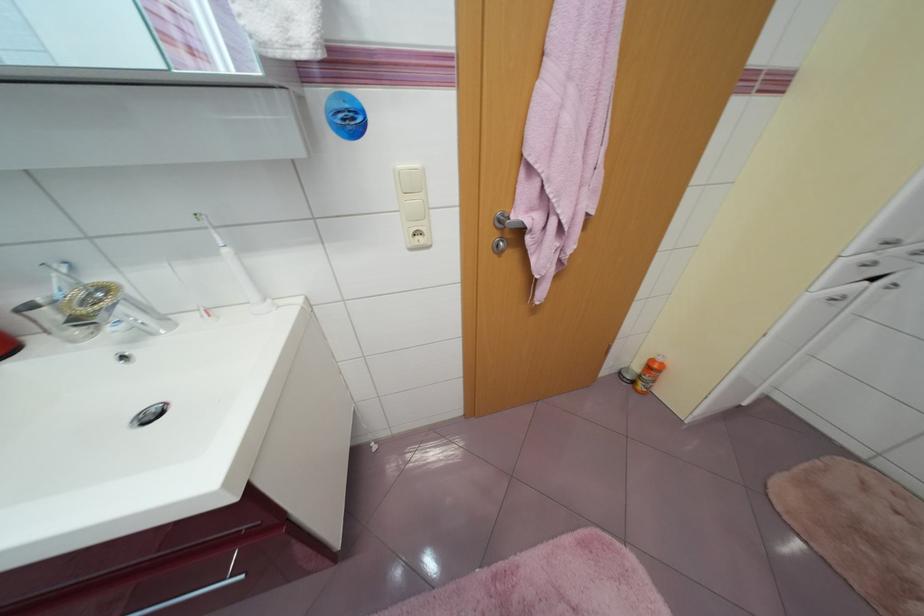
Where would you turn the silver door lock? Please return your answer as a coordinate pair (x, y).

(504, 230)